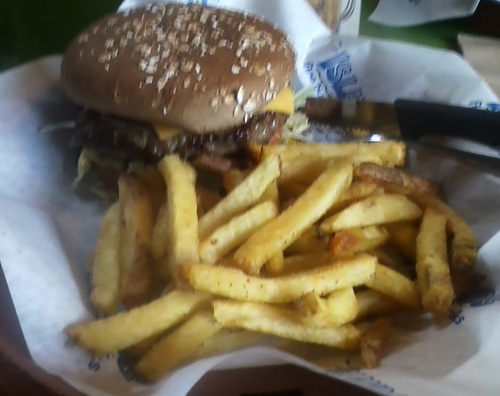
You are a GUI agent. You are given a task and a screenshot of the screen. Output one action in this format:
    pyautogui.click(x=<x>, y=<y>)
    Task: Click on the handle
    The height and width of the screenshot is (396, 500).
    Given the screenshot: What is the action you would take?
    pyautogui.click(x=446, y=119)